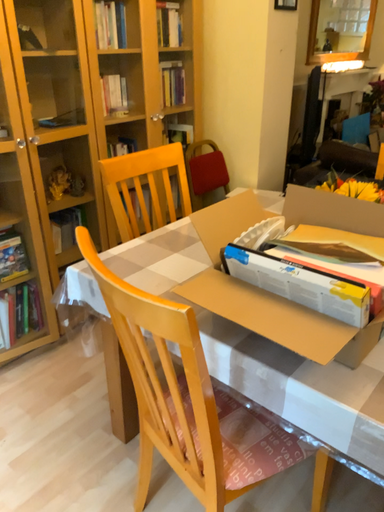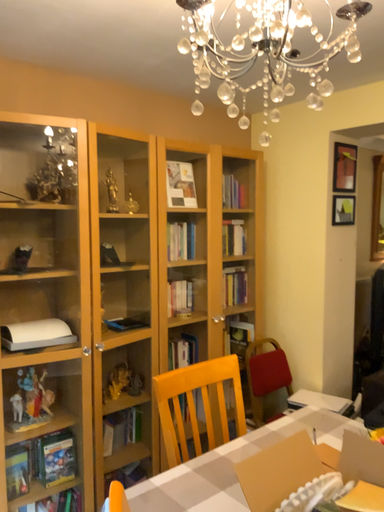
Question: How did the camera likely rotate when shooting the video?

Choices:
 (A) rotated downward
 (B) rotated upward

Answer: (B)